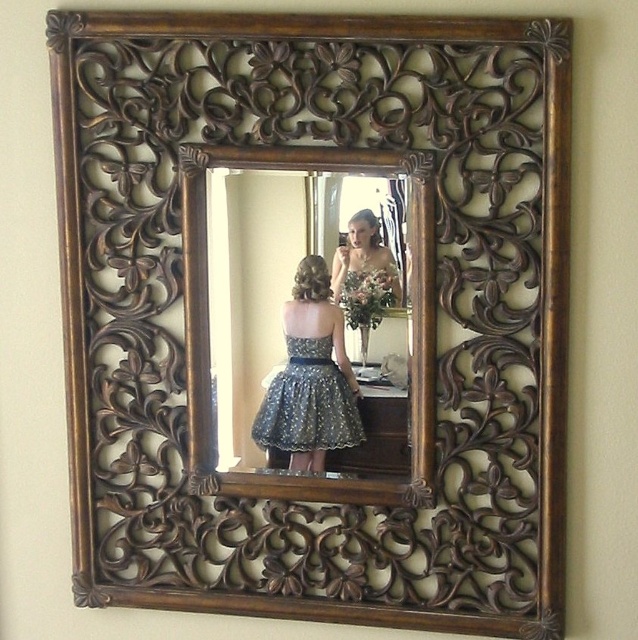
Question: Can you confirm if sparkly dark blue dress at center is positioned above matte silver dress at center?

Choices:
 (A) no
 (B) yes

Answer: (A)

Question: Does matte silver dress at center appear on the right side of green matte bouquet at center?

Choices:
 (A) no
 (B) yes

Answer: (B)

Question: Which point is closer to the camera?

Choices:
 (A) (216, 161)
 (B) (359, 412)
 (C) (345, 275)

Answer: (A)

Question: Based on their relative distances, which object is nearer to the green matte bouquet at center?

Choices:
 (A) wooden carved mirror at center
 (B) matte silver dress at center
 (C) sparkly dark blue dress at center

Answer: (B)

Question: Considering the real-world distances, which object is closest to the sparkly dark blue dress at center?

Choices:
 (A) green matte bouquet at center
 (B) matte silver dress at center
 (C) wooden carved mirror at center

Answer: (C)

Question: Does wooden carved mirror at center appear on the left side of sparkly dark blue dress at center?

Choices:
 (A) yes
 (B) no

Answer: (A)